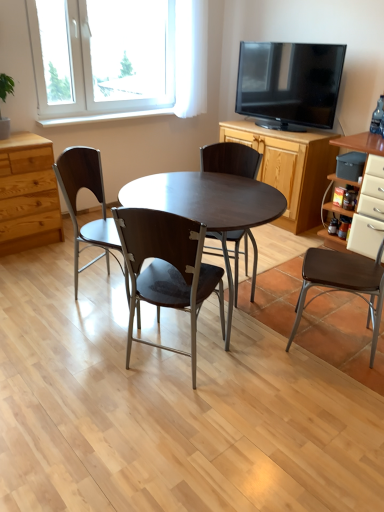
Find the location of `free spot in front of brown leather chair at right, the fourth chair from the left`. free spot in front of brown leather chair at right, the fourth chair from the left is located at coordinates (335, 388).